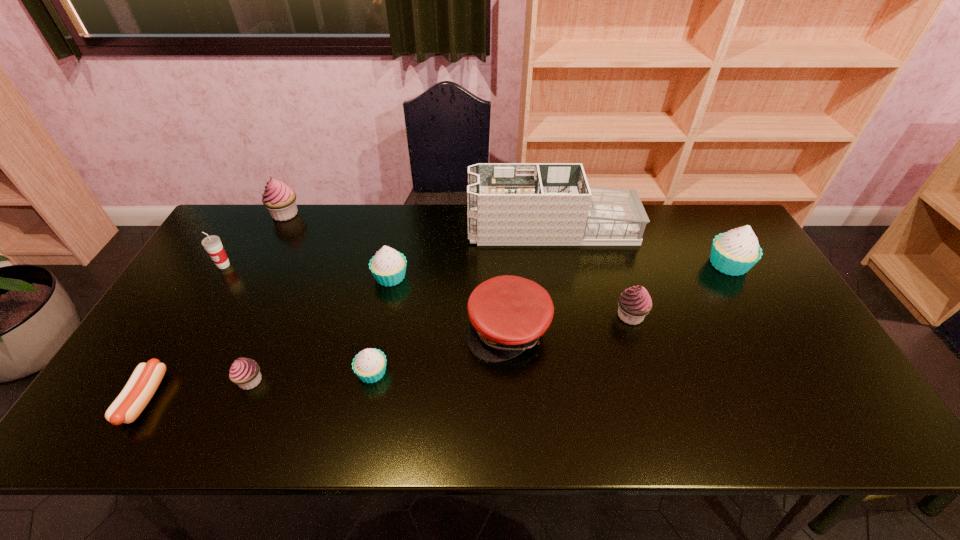
You are a GUI agent. You are given a task and a screenshot of the screen. Output one action in this format:
    pyautogui.click(x=<x>, y=<y>)
    Task: Click on the tallest object
    Image resolution: width=960 pixels, height=540 pixels.
    Given the screenshot: What is the action you would take?
    (x=508, y=203)

This screenshot has width=960, height=540. Find the location of `the farthest pink cupcake`. the farthest pink cupcake is located at coordinates (280, 199).

I want to click on the third object from left to right, so click(x=280, y=199).

Where is `the rightmost object`? Image resolution: width=960 pixels, height=540 pixels. the rightmost object is located at coordinates (735, 252).

At what (x,y) coordinates should I click in order to perform the action: click on the rightmost white cupcake. Please return your answer as a coordinate pair (x, y). This screenshot has width=960, height=540. Looking at the image, I should click on (735, 252).

What are the coordinates of `red cup` in the screenshot? It's located at (212, 244).

Where is `the second smallest white cupcake`? This screenshot has height=540, width=960. the second smallest white cupcake is located at coordinates (388, 266).

Locate an element on the screen. the fourth farthest cupcake is located at coordinates (635, 303).

Locate an element on the screen. The width and height of the screenshot is (960, 540). the fifth cupcake from left to right is located at coordinates (635, 303).

The width and height of the screenshot is (960, 540). What are the coordinates of `cap` in the screenshot? It's located at (508, 314).